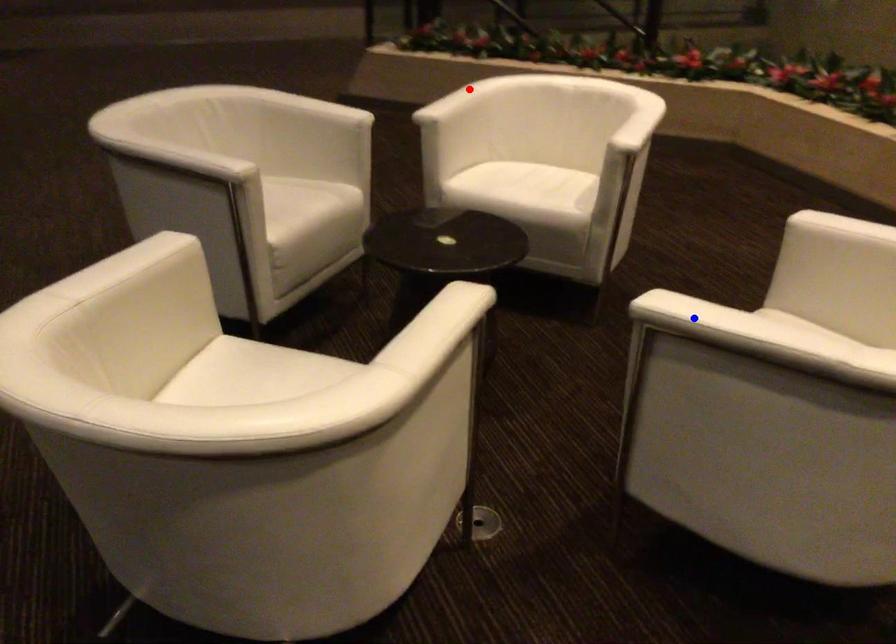
Question: Two points are marked on the image. Which point is closer to the camera?

Choices:
 (A) Blue point is closer.
 (B) Red point is closer.

Answer: (A)